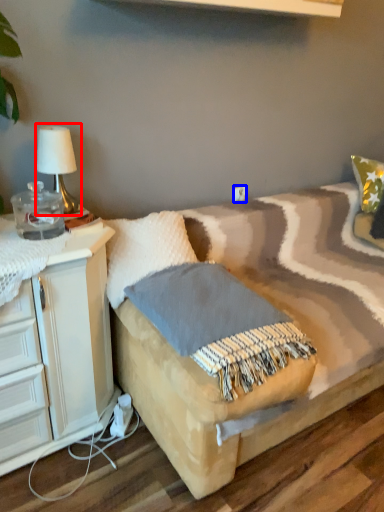
Question: Which of the following is the closest to the observer, table lamp (highlighted by a red box) or electric outlet (highlighted by a blue box)?

Choices:
 (A) table lamp
 (B) electric outlet

Answer: (A)